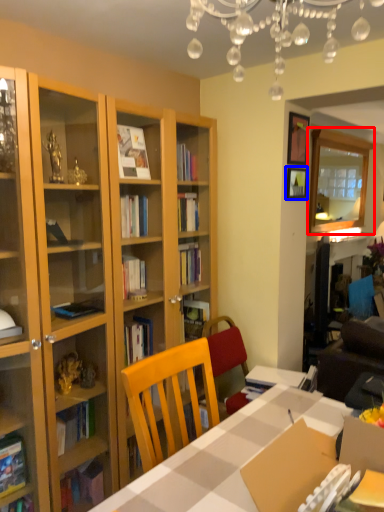
Question: Which point is closer to the camera, glass door (highlighted by a red box) or picture frame (highlighted by a blue box)?

Choices:
 (A) glass door
 (B) picture frame

Answer: (B)